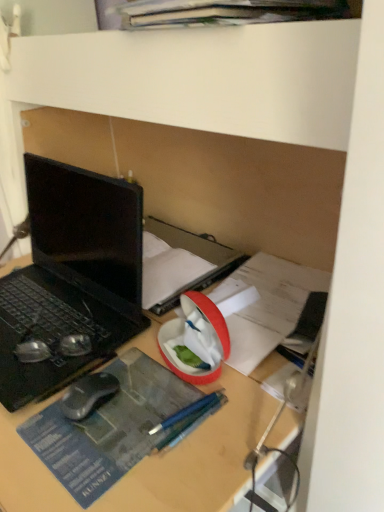
This screenshot has height=512, width=384. I want to click on vacant space that is in between black rubberized mouse at lower left and metallic blue pencil at center, so click(x=136, y=409).